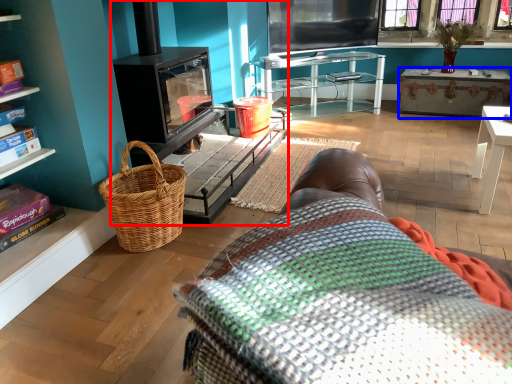
Question: Which of the following is the farthest to the observer, fireplace (highlighted by a red box) or desk (highlighted by a blue box)?

Choices:
 (A) fireplace
 (B) desk

Answer: (B)